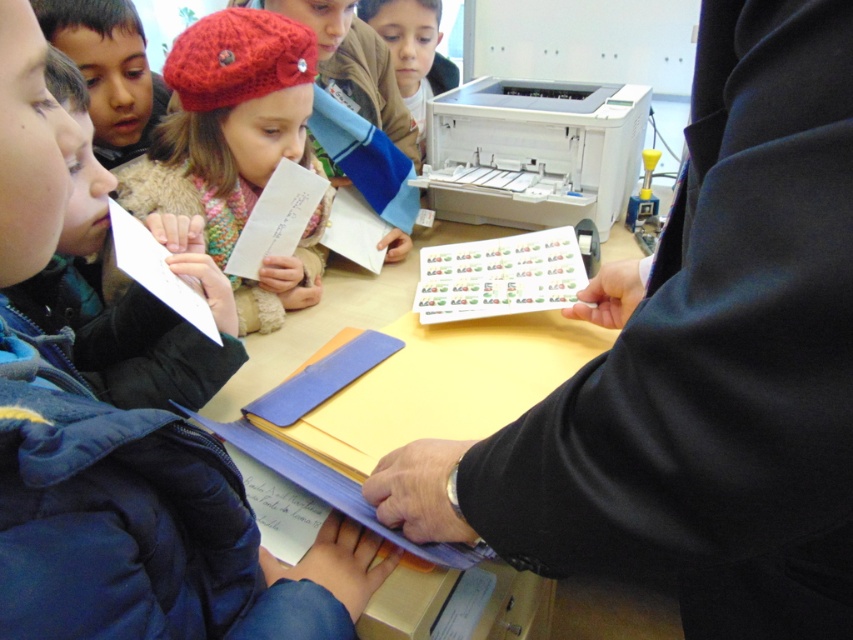
Question: Is black matte folder at center behind matte blue jacket at left?

Choices:
 (A) yes
 (B) no

Answer: (B)

Question: Does white glossy stickers at center appear on the right side of white paper at lower left?

Choices:
 (A) no
 (B) yes

Answer: (B)

Question: Which object is farther from the camera taking this photo?

Choices:
 (A) white glossy stickers at center
 (B) black matte folder at center
 (C) white paper at lower left
 (D) matte blue jacket at left

Answer: (D)

Question: Does yellow matte table at center appear over white paper at lower left?

Choices:
 (A) yes
 (B) no

Answer: (B)

Question: Which point is closer to the camera taking this photo?

Choices:
 (A) (366, 243)
 (B) (219, 76)
 (C) (578, 419)

Answer: (C)

Question: Estimate the real-world distances between objects in this image. Which object is farther from the matte blue jacket at left?

Choices:
 (A) knitted red beret at upper left
 (B) white paper at center

Answer: (B)